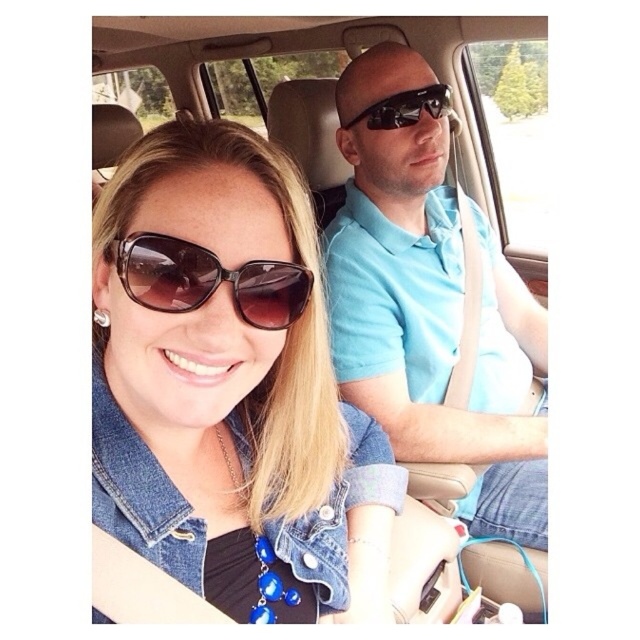
Question: Which of the following is the farthest from the observer?

Choices:
 (A) (193, 221)
 (B) (422, 108)
 (C) (184, 296)
 (D) (422, 128)

Answer: (B)

Question: Which point appears closest to the camera in this image?

Choices:
 (A) (276, 288)
 (B) (122, 176)
 (C) (432, 108)

Answer: (A)

Question: Can you confirm if light blue polo shirt at center is positioned below brown matte sunglasses at center?

Choices:
 (A) yes
 (B) no

Answer: (B)

Question: Is brown matte sunglasses at center bigger than black reflective sunglasses at upper center?

Choices:
 (A) no
 (B) yes

Answer: (A)

Question: Does light blue polo shirt at center lie in front of black reflective sunglasses at upper center?

Choices:
 (A) yes
 (B) no

Answer: (A)

Question: Which point is closer to the camera taking this photo?

Choices:
 (A) (433, 371)
 (B) (161, 282)

Answer: (B)